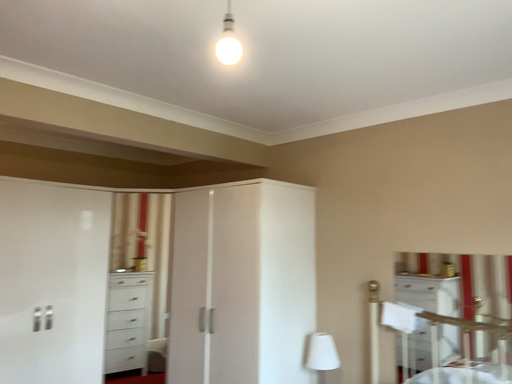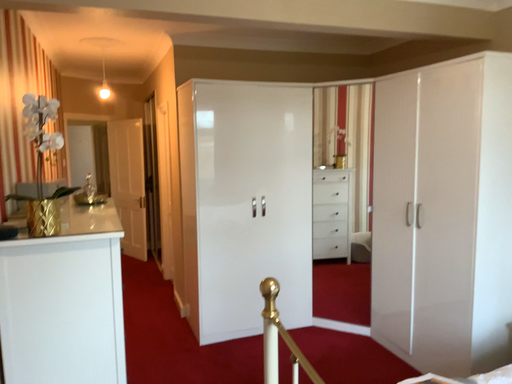
Question: Which way did the camera rotate in the video?

Choices:
 (A) rotated upward
 (B) rotated downward

Answer: (B)